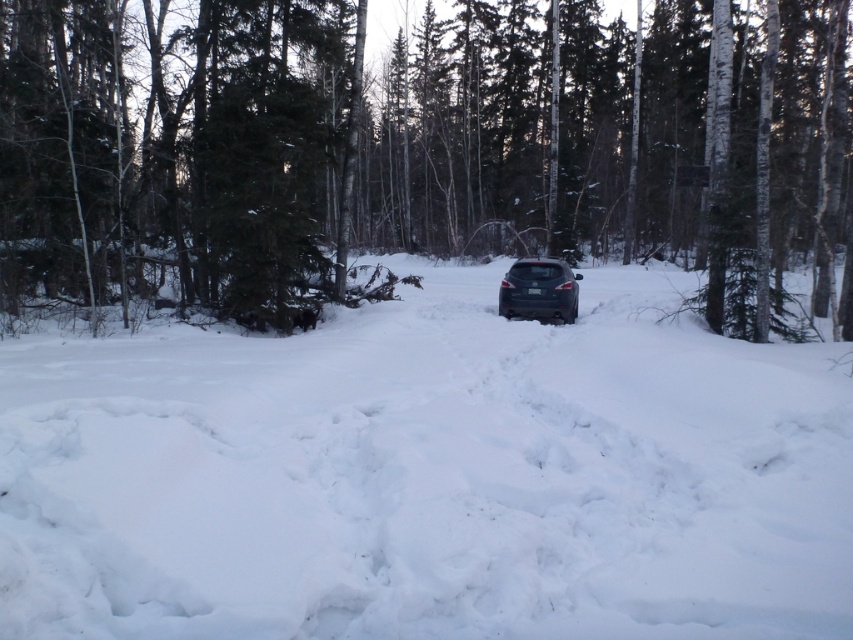
Question: Which of the following is the farthest from the observer?

Choices:
 (A) satin black car at center
 (B) green textured pine tree at center
 (C) white fluffy snow at center

Answer: (A)

Question: Does white fluffy snow at center have a smaller size compared to green textured pine tree at center?

Choices:
 (A) yes
 (B) no

Answer: (A)

Question: Among these points, which one is nearest to the camera?

Choices:
 (A) (541, 257)
 (B) (361, 132)

Answer: (A)

Question: Does green textured pine tree at center appear on the left side of satin black car at center?

Choices:
 (A) yes
 (B) no

Answer: (B)

Question: Which object is closer to the camera taking this photo?

Choices:
 (A) white fluffy snow at center
 (B) green textured pine tree at center
 (C) satin black car at center

Answer: (A)

Question: Observing the image, what is the correct spatial positioning of white fluffy snow at center in reference to satin black car at center?

Choices:
 (A) left
 (B) right

Answer: (A)